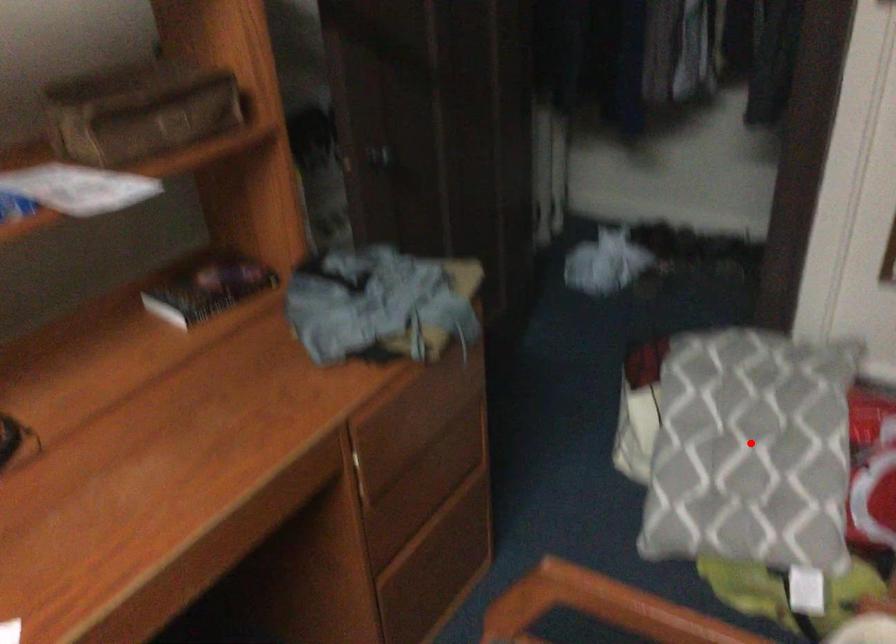
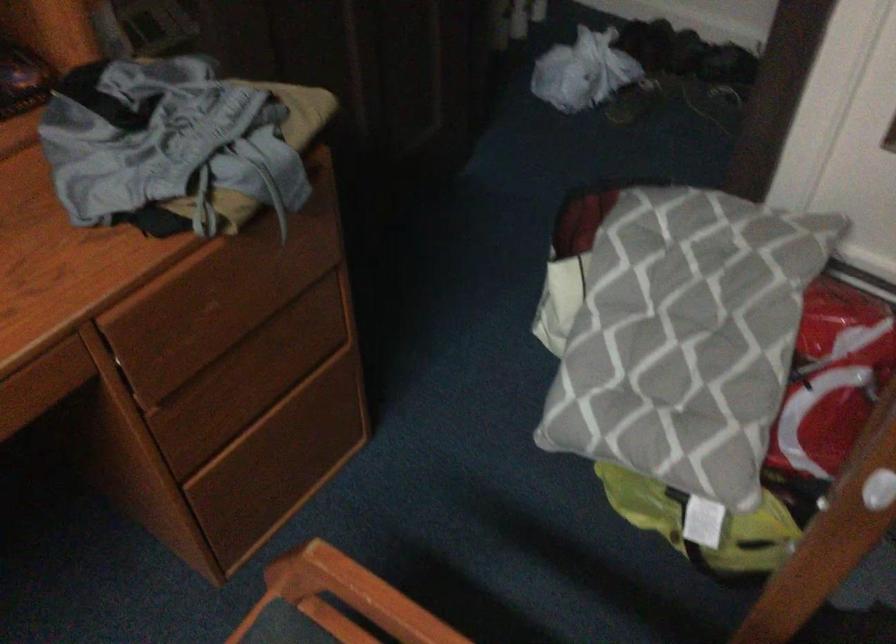
In the second image, find the point that corresponds to the highlighted location in the first image.

(677, 335)